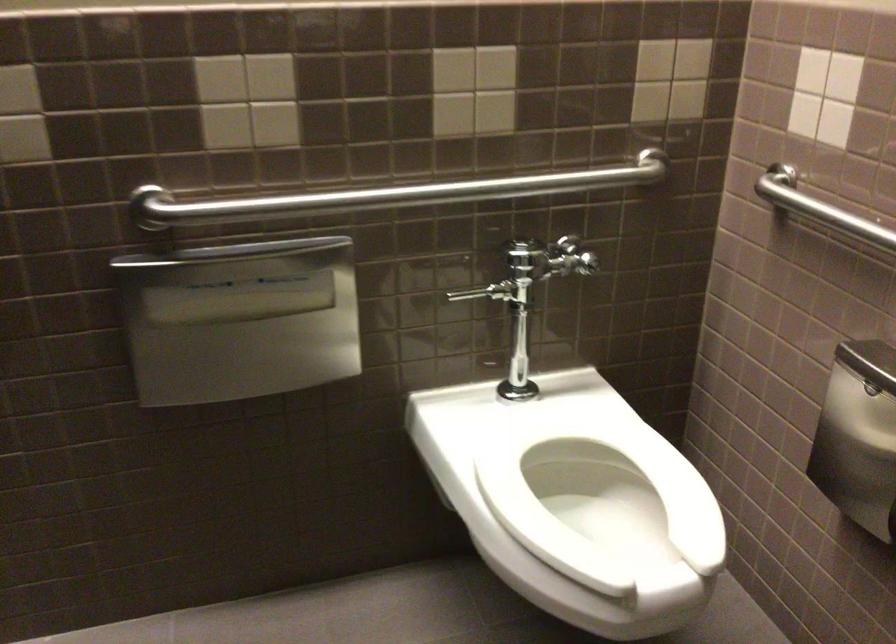
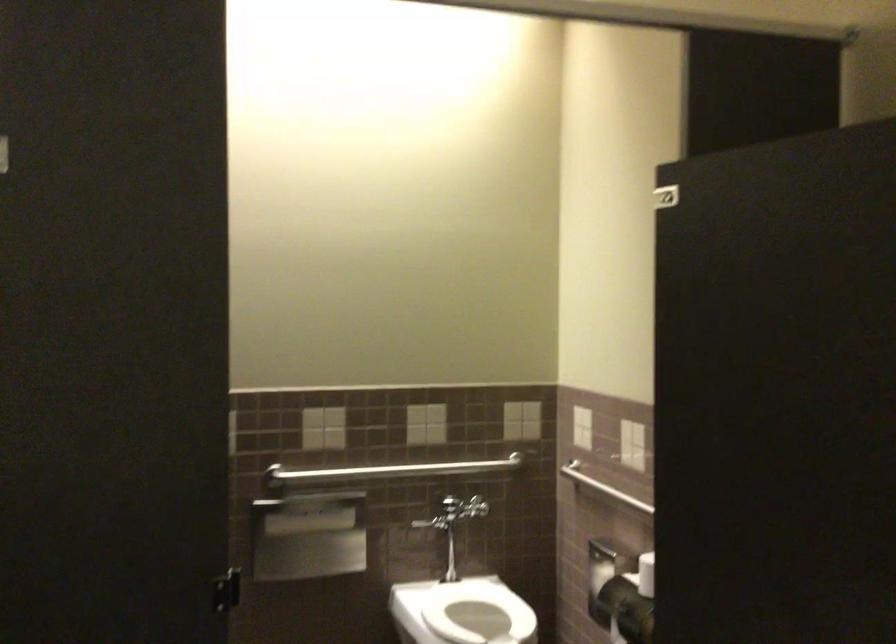
Question: In a continuous first-person perspective shot, in which direction is the camera moving?

Choices:
 (A) Left
 (B) Right
 (C) Forward
 (D) Backward

Answer: (D)